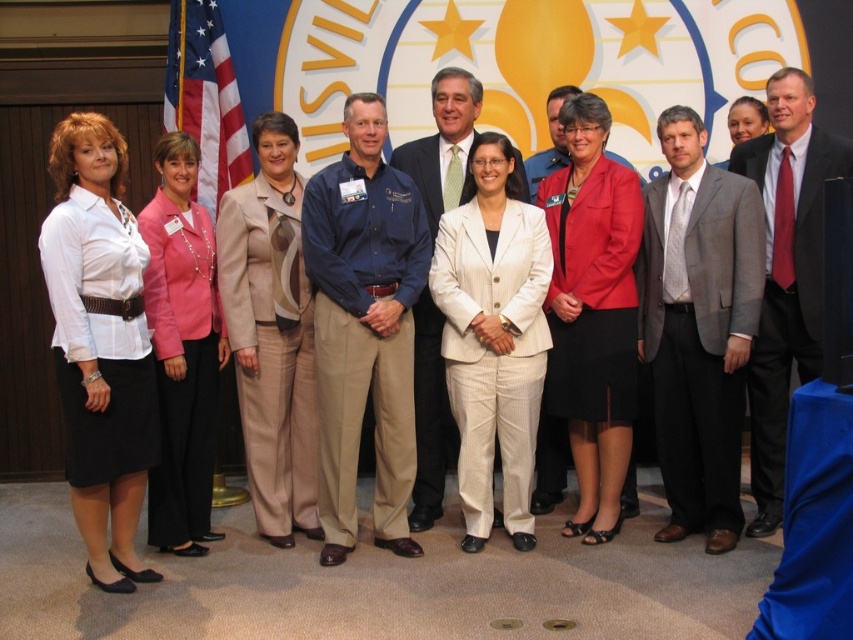
In the photograph of the group posing in front of the USVI emblem, there is a blue cotton shirt at center and a matte red blazer at center. Which one is more to the left?

The blue cotton shirt at center is positioned on the left side of matte red blazer at center, so the blue cotton shirt at center is more to the left.

Based on the scene description, which object has a greater height between the pink fabric jacket at left and the light beige suit at center?

The pink fabric jacket at left has a greater height compared to the light beige suit at center.

You are a photographer trying to adjust the lighting for a group photo. You notice two points in the image at coordinates point (190, 156) and point (428, 460). Which point is closer to the camera?

Point (190, 156) is in front of point (428, 460), so it is closer to the camera.